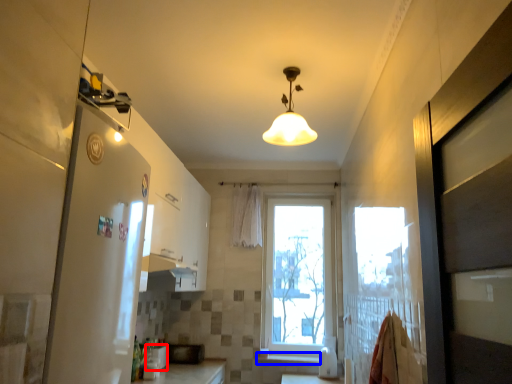
Question: Which point is further to the camera, appliance (highlighted by a red box) or window sill (highlighted by a blue box)?

Choices:
 (A) appliance
 (B) window sill

Answer: (B)